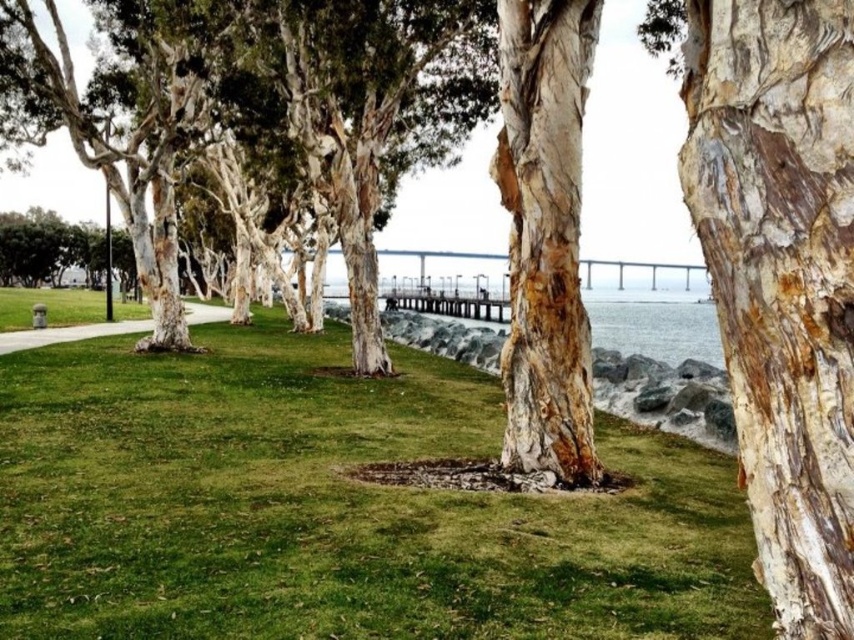
Which of these two, green grass at center or green bark tree at center, stands taller?

green bark tree at center

Is green grass at center thinner than green bark tree at center?

Correct, green grass at center's width is less than green bark tree at center's.

Who is more distant from viewer, (325, 609) or (118, 248)?

Positioned behind is point (118, 248).

The width and height of the screenshot is (854, 640). I want to click on green grass at center, so click(334, 508).

Which is more to the left, green bark tree at center or green grass at lower left?

Positioned to the left is green bark tree at center.

Identify the location of green bark tree at center. The image size is (854, 640). (45, 248).

Where is `green bark tree at center`? Image resolution: width=854 pixels, height=640 pixels. green bark tree at center is located at coordinates (45, 248).

Is white bark tree at center bigger than green bark tree at center?

Yes.

Is white bark tree at center further to camera compared to green bark tree at center?

No, it is not.

Describe the element at coordinates (267, 96) in the screenshot. I see `white bark tree at center` at that location.

Where is `white bark tree at center`? The image size is (854, 640). white bark tree at center is located at coordinates (267, 96).